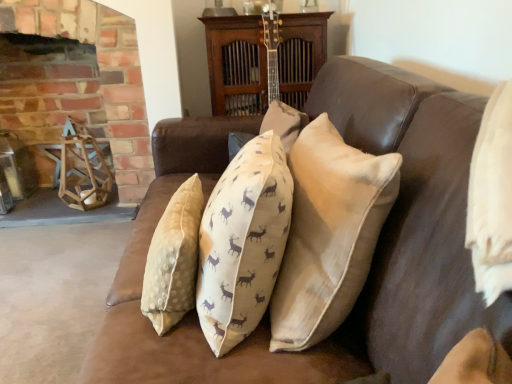
Question: Is point (44, 72) positioned closer to the camera than point (350, 160)?

Choices:
 (A) closer
 (B) farther

Answer: (B)

Question: Is brick fireplace at upper left inside the boundaries of beige textured pillow at center, or outside?

Choices:
 (A) inside
 (B) outside

Answer: (B)

Question: Considering the positions of brick fireplace at upper left and beige textured pillow at center in the image, is brick fireplace at upper left taller or shorter than beige textured pillow at center?

Choices:
 (A) tall
 (B) short

Answer: (A)

Question: Is beige textured pillow at center wider or thinner than brick fireplace at upper left?

Choices:
 (A) wide
 (B) thin

Answer: (B)

Question: In the image, is beige textured pillow at center on the left side or the right side of brick fireplace at upper left?

Choices:
 (A) left
 (B) right

Answer: (B)

Question: In terms of size, does beige textured pillow at center appear bigger or smaller than brick fireplace at upper left?

Choices:
 (A) small
 (B) big

Answer: (A)

Question: Relative to brick fireplace at upper left, is beige textured pillow at center in front or behind?

Choices:
 (A) behind
 (B) front

Answer: (B)